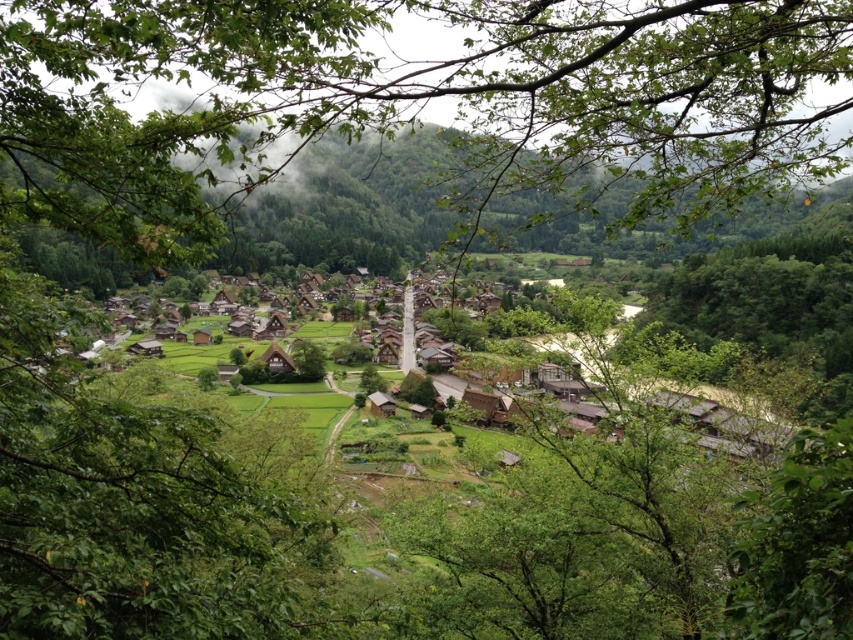
Who is positioned more to the right, green leafy branches at center or wooden thatched hut at center?

green leafy branches at center is more to the right.

Does green leafy branches at center appear on the right side of wooden thatched hut at center?

Indeed, green leafy branches at center is positioned on the right side of wooden thatched hut at center.

The image size is (853, 640). What do you see at coordinates (427, 99) in the screenshot?
I see `green leafy branches at center` at bounding box center [427, 99].

You are a GUI agent. You are given a task and a screenshot of the screen. Output one action in this format:
    pyautogui.click(x=<x>, y=<y>)
    Task: Click on the green leafy branches at center
    This screenshot has height=640, width=853.
    Given the screenshot: What is the action you would take?
    pyautogui.click(x=427, y=99)

Is point (693, 58) farther from camera compared to point (383, 410)?

No.

The image size is (853, 640). I want to click on green leafy branches at center, so click(x=427, y=99).

Can you confirm if wooden thatched hut at center is positioned below wooden hut at center?

No.

This screenshot has width=853, height=640. I want to click on wooden thatched hut at center, so click(276, 358).

Find the location of a particular element. wooden thatched hut at center is located at coordinates (276, 358).